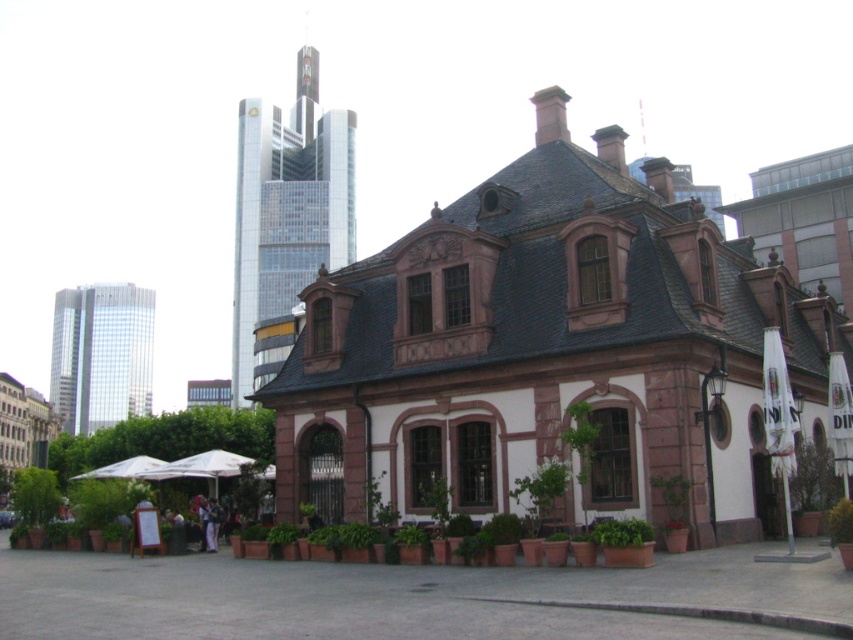
Is pink stone building at center smaller than white fabric umbrella at right?

Actually, pink stone building at center might be larger than white fabric umbrella at right.

From the picture: Who is more distant from viewer, (549, 250) or (778, 452)?

Point (549, 250)

You are a GUI agent. You are given a task and a screenshot of the screen. Output one action in this format:
    pyautogui.click(x=<x>, y=<y>)
    Task: Click on the pink stone building at center
    Image resolution: width=853 pixels, height=640 pixels.
    Given the screenshot: What is the action you would take?
    pyautogui.click(x=549, y=349)